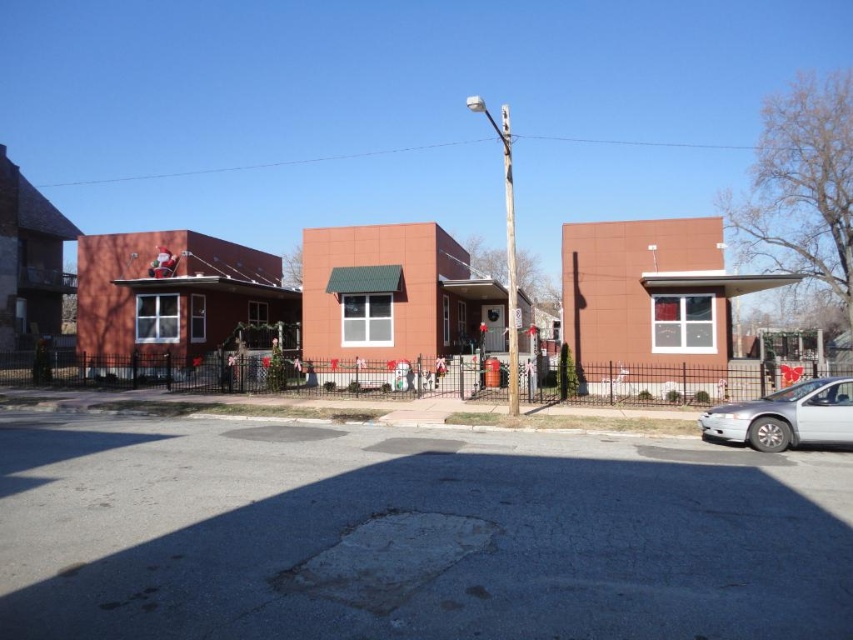
This screenshot has height=640, width=853. I want to click on silver metallic sedan at lower right, so click(786, 417).

Between silver metallic sedan at lower right and white wooden pole at center, which one is positioned higher?

white wooden pole at center is above.

Is point (769, 419) positioned behind point (515, 340)?

No, (769, 419) is in front of (515, 340).

Identify the location of silver metallic sedan at lower right. Image resolution: width=853 pixels, height=640 pixels. (786, 417).